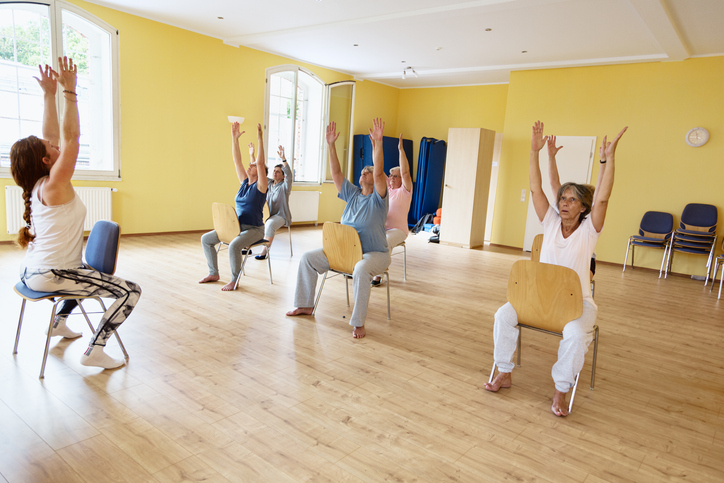
The image size is (724, 483). In order to click on backs of chairs in this screenshot , I will do `click(108, 243)`, `click(229, 220)`, `click(347, 231)`, `click(552, 279)`, `click(702, 212)`, `click(657, 219)`.